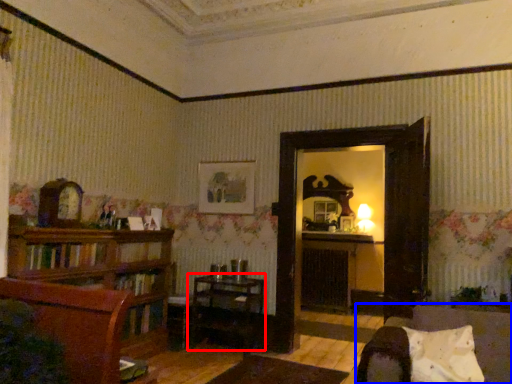
Question: Among these objects, which one is nearest to the camera, table (highlighted by a red box) or chair (highlighted by a blue box)?

Choices:
 (A) table
 (B) chair

Answer: (B)